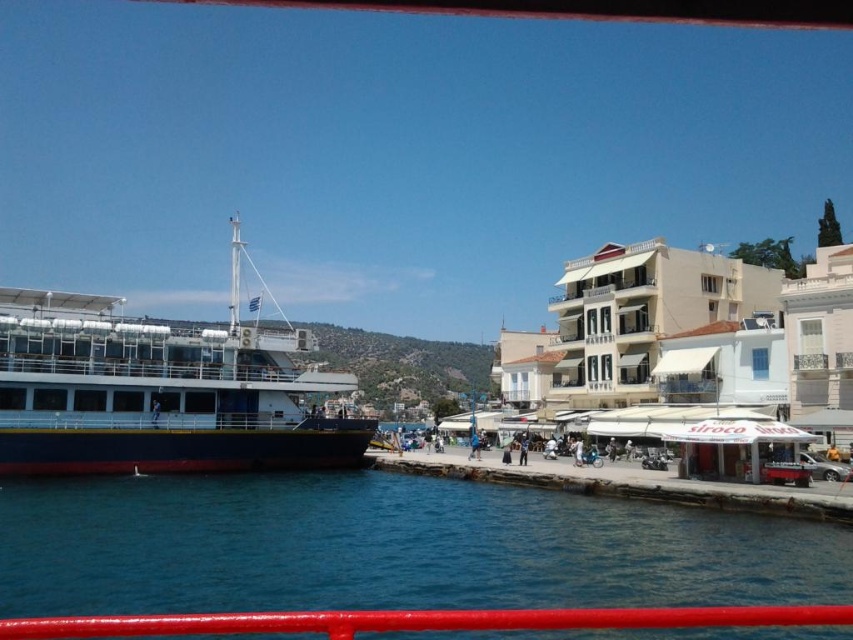
Between point (184, 452) and point (520, 436), which one is positioned behind?

Positioned behind is point (520, 436).

Who is positioned more to the right, blue matte ship at left or blue fabric umbrella at lower center?

blue fabric umbrella at lower center is more to the right.

Which is behind, point (299, 460) or point (525, 452)?

Positioned behind is point (525, 452).

The height and width of the screenshot is (640, 853). Identify the location of blue matte ship at left. (160, 390).

Is smooth glossy rail at lower center further to the viewer compared to blue fabric bag at lower center?

No, smooth glossy rail at lower center is in front of blue fabric bag at lower center.

Can you confirm if smooth glossy rail at lower center is positioned below blue fabric bag at lower center?

Correct, smooth glossy rail at lower center is located below blue fabric bag at lower center.

What do you see at coordinates (421, 620) in the screenshot? I see `smooth glossy rail at lower center` at bounding box center [421, 620].

I want to click on smooth glossy rail at lower center, so click(x=421, y=620).

Does blue fabric bag at lower center lie behind blue fabric umbrella at lower center?

Yes, it is.

Can you confirm if blue fabric bag at lower center is smaller than blue fabric umbrella at lower center?

Actually, blue fabric bag at lower center might be larger than blue fabric umbrella at lower center.

Is point (469, 435) more distant than point (521, 464)?

Yes, it is.

Locate an element on the screen. blue fabric bag at lower center is located at coordinates (474, 444).